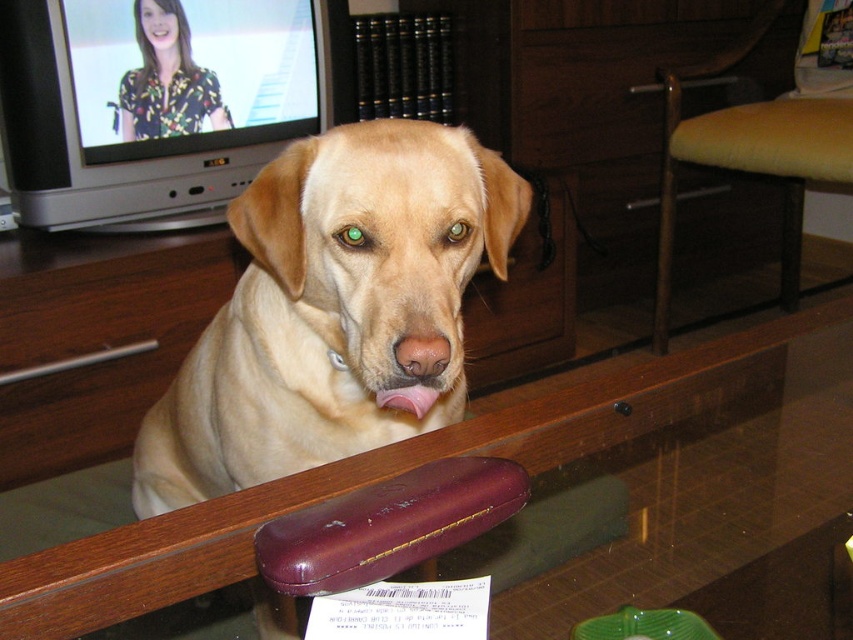
Question: Which object appears closest to the camera in this image?

Choices:
 (A) light brown fur at center
 (B) transparent glass table at center

Answer: (B)

Question: Does light brown fur at center appear over transparent glass table at center?

Choices:
 (A) yes
 (B) no

Answer: (A)

Question: Does light brown fur at center have a larger size compared to transparent glass table at center?

Choices:
 (A) no
 (B) yes

Answer: (A)

Question: Which point is farther to the camera?

Choices:
 (A) (184, 531)
 (B) (408, 348)

Answer: (A)

Question: Which point appears farthest from the camera in this image?

Choices:
 (A) (334, 312)
 (B) (421, 458)

Answer: (B)

Question: Is light brown fur at center bigger than transparent glass table at center?

Choices:
 (A) no
 (B) yes

Answer: (A)